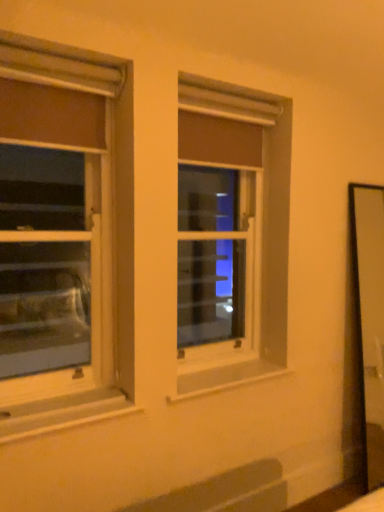
What do you see at coordinates (62, 413) in the screenshot?
I see `white painted wood at lower left` at bounding box center [62, 413].

Image resolution: width=384 pixels, height=512 pixels. Identify the location of clear glass window at center, marked as the 1th window in a back-to-front arrangement. (231, 234).

Considering the sizes of objects clear glass window at center, which is the second window from front to back, and matte white window at left, which is the 1th window from left to right, in the image provided, who is wider, clear glass window at center, which is the second window from front to back, or matte white window at left, which is the 1th window from left to right,?

matte white window at left, which is the 1th window from left to right, is wider.

Is clear glass window at center, arranged as the second window when viewed from the left, in front of matte white window at left, which is the 2th window in back-to-front order?

No, clear glass window at center, arranged as the second window when viewed from the left, is behind matte white window at left, which is the 2th window in back-to-front order.

Considering the sizes of objects clear glass window at center, positioned as the 1th window in right-to-left order, and matte white window at left, which is the 1th window from left to right, in the image provided, who is shorter, clear glass window at center, positioned as the 1th window in right-to-left order, or matte white window at left, which is the 1th window from left to right,?

matte white window at left, which is the 1th window from left to right.

Find the location of a particular element. window below the clear glass window at center, which is the second window from front to back (from the image's perspective) is located at coordinates (64, 237).

Does white painted wood at lower left have a lesser height compared to matte white window at left, marked as the 2th window in a right-to-left arrangement?

Yes.

Between point (8, 434) and point (94, 217), which one is positioned in front?

The point (8, 434) is in front.

From a real-world perspective, is white painted wood at lower left located higher than matte white window at left, which is the 1th window from left to right?

Actually, white painted wood at lower left is physically below matte white window at left, which is the 1th window from left to right, in the real world.

Is white painted wood at lower left far away from matte white window at left, which is the 1th window from left to right?

white painted wood at lower left is far away from matte white window at left, which is the 1th window from left to right.

Is white painted wood at lower left closer to the viewer compared to clear glass window at center, marked as the 1th window in a back-to-front arrangement?

Yes, it is in front of clear glass window at center, marked as the 1th window in a back-to-front arrangement.

From a real-world perspective, is white painted wood at lower left physically located above or below clear glass window at center, positioned as the 1th window in right-to-left order?

Clearly, from a real-world perspective, white painted wood at lower left is below clear glass window at center, positioned as the 1th window in right-to-left order.

Is white painted wood at lower left facing away from clear glass window at center, positioned as the 1th window in right-to-left order?

white painted wood at lower left is not turned away from clear glass window at center, positioned as the 1th window in right-to-left order.

Based on the photo, is white painted wood at lower left not near clear glass window at center, marked as the 1th window in a back-to-front arrangement?

No, white painted wood at lower left is in close proximity to clear glass window at center, marked as the 1th window in a back-to-front arrangement.

Is clear glass window at center, marked as the 1th window in a back-to-front arrangement, directly adjacent to white painted wood at lower left?

clear glass window at center, marked as the 1th window in a back-to-front arrangement, is not next to white painted wood at lower left, and they're not touching.

From the image's perspective, which object appears higher, clear glass window at center, positioned as the 1th window in right-to-left order, or white painted wood at lower left?

From the image's view, clear glass window at center, positioned as the 1th window in right-to-left order, is above.

Identify the location of the 2nd window behind the white painted wood at lower left. The image size is (384, 512). (231, 234).

Is clear glass window at center, arranged as the second window when viewed from the left, facing away from white painted wood at lower left?

No, clear glass window at center, arranged as the second window when viewed from the left, is not facing away from white painted wood at lower left.

Between matte white window at left, the 1th window from the front, and white painted wood at lower left, which one has less height?

Standing shorter between the two is white painted wood at lower left.

Considering the relative sizes of matte white window at left, the 1th window from the front, and white painted wood at lower left in the image provided, is matte white window at left, the 1th window from the front, wider than white painted wood at lower left?

Incorrect, the width of matte white window at left, the 1th window from the front, does not surpass that of white painted wood at lower left.

Locate an element on the screen. The image size is (384, 512). window sill that appears in front of the matte white window at left, the 1th window from the front is located at coordinates (62, 413).

Is matte white window at left, the 1th window from the front, oriented towards white painted wood at lower left?

Yes, matte white window at left, the 1th window from the front, is oriented towards white painted wood at lower left.

From a real-world perspective, is matte white window at left, which is the 1th window from left to right, on top of clear glass window at center, positioned as the 1th window in right-to-left order?

Yes, from a real-world perspective, matte white window at left, which is the 1th window from left to right, is over clear glass window at center, positioned as the 1th window in right-to-left order

Based on their sizes in the image, would you say matte white window at left, the 1th window from the front, is bigger or smaller than clear glass window at center, positioned as the 1th window in right-to-left order?

Considering their sizes, matte white window at left, the 1th window from the front, takes up more space than clear glass window at center, positioned as the 1th window in right-to-left order.

Is matte white window at left, marked as the 2th window in a right-to-left arrangement, oriented towards clear glass window at center, marked as the 1th window in a back-to-front arrangement?

No, matte white window at left, marked as the 2th window in a right-to-left arrangement, is not turned towards clear glass window at center, marked as the 1th window in a back-to-front arrangement.

Find the location of `window on the left of clear glass window at center, arranged as the second window when viewed from the left`. window on the left of clear glass window at center, arranged as the second window when viewed from the left is located at coordinates click(64, 237).

Find the location of a particular element. This screenshot has width=384, height=512. window sill below the matte white window at left, which is the 1th window from left to right (from a real-world perspective) is located at coordinates (62, 413).

Looking at the image, which one is located further to clear glass window at center, which is the second window from front to back, matte white window at left, which is the 2th window in back-to-front order, or white painted wood at lower left?

matte white window at left, which is the 2th window in back-to-front order.

Looking at the image, which one is located further to white painted wood at lower left, clear glass window at center, arranged as the second window when viewed from the left, or matte white window at left, the 1th window from the front?

matte white window at left, the 1th window from the front.

Based on their spatial positions, is white painted wood at lower left or clear glass window at center, arranged as the second window when viewed from the left, further from matte white window at left, the 1th window from the front?

white painted wood at lower left.

Which object lies nearer to the anchor point clear glass window at center, positioned as the 1th window in right-to-left order, white painted wood at lower left or matte white window at left, marked as the 2th window in a right-to-left arrangement?

Among the two, white painted wood at lower left is located nearer to clear glass window at center, positioned as the 1th window in right-to-left order.

When comparing their distances from white painted wood at lower left, does matte white window at left, which is the 2th window in back-to-front order, or clear glass window at center, arranged as the second window when viewed from the left, seem further?

matte white window at left, which is the 2th window in back-to-front order, is further to white painted wood at lower left.

Looking at the image, which one is located further to matte white window at left, which is the 1th window from left to right, clear glass window at center, positioned as the 1th window in right-to-left order, or white painted wood at lower left?

white painted wood at lower left is further to matte white window at left, which is the 1th window from left to right.

Find the location of a particular element. This screenshot has height=512, width=384. window between clear glass window at center, which is the second window from front to back, and white painted wood at lower left in the up-down direction is located at coordinates (64, 237).